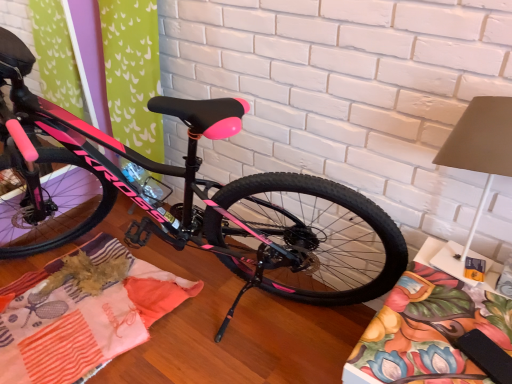
Question: Considering the relative positions of pink glossy bicycle at center and patchwork fabric at center, which is counted as the second blanket, starting from the right, in the image provided, is pink glossy bicycle at center to the left of patchwork fabric at center, which is counted as the second blanket, starting from the right, from the viewer's perspective?

Choices:
 (A) no
 (B) yes

Answer: (A)

Question: Does pink glossy bicycle at center have a lesser height compared to patchwork fabric at center, which appears as the first blanket when viewed from the left?

Choices:
 (A) yes
 (B) no

Answer: (B)

Question: Considering the relative positions of pink glossy bicycle at center and patchwork fabric at center, which appears as the first blanket when viewed from the left, in the image provided, is pink glossy bicycle at center to the right of patchwork fabric at center, which appears as the first blanket when viewed from the left, from the viewer's perspective?

Choices:
 (A) yes
 (B) no

Answer: (A)

Question: Considering the relative sizes of pink glossy bicycle at center and patchwork fabric at center, which appears as the first blanket when viewed from the left, in the image provided, is pink glossy bicycle at center thinner than patchwork fabric at center, which appears as the first blanket when viewed from the left,?

Choices:
 (A) yes
 (B) no

Answer: (B)

Question: Is the position of pink glossy bicycle at center less distant than that of patchwork fabric at center, which is counted as the second blanket, starting from the right?

Choices:
 (A) yes
 (B) no

Answer: (A)

Question: From a real-world perspective, is pink glossy bicycle at center located higher than patchwork fabric at center, which appears as the first blanket when viewed from the left?

Choices:
 (A) yes
 (B) no

Answer: (A)

Question: From a real-world perspective, is floral fabric cushion at lower right, arranged as the first blanket when viewed from the right, over pink glossy bicycle at center?

Choices:
 (A) no
 (B) yes

Answer: (A)

Question: Is floral fabric cushion at lower right, arranged as the first blanket when viewed from the right, touching pink glossy bicycle at center?

Choices:
 (A) yes
 (B) no

Answer: (B)

Question: Considering the relative positions of floral fabric cushion at lower right, arranged as the first blanket when viewed from the right, and pink glossy bicycle at center in the image provided, is floral fabric cushion at lower right, arranged as the first blanket when viewed from the right, to the left of pink glossy bicycle at center from the viewer's perspective?

Choices:
 (A) yes
 (B) no

Answer: (B)

Question: Can we say floral fabric cushion at lower right, which appears as the 2th blanket when viewed from the left, lies outside pink glossy bicycle at center?

Choices:
 (A) yes
 (B) no

Answer: (A)

Question: From the image's perspective, is floral fabric cushion at lower right, which appears as the 2th blanket when viewed from the left, under pink glossy bicycle at center?

Choices:
 (A) yes
 (B) no

Answer: (A)

Question: Can you confirm if floral fabric cushion at lower right, arranged as the first blanket when viewed from the right, is thinner than pink glossy bicycle at center?

Choices:
 (A) no
 (B) yes

Answer: (B)

Question: Can you confirm if floral fabric cushion at lower right, arranged as the first blanket when viewed from the right, is bigger than patchwork fabric at center, which appears as the first blanket when viewed from the left?

Choices:
 (A) no
 (B) yes

Answer: (B)